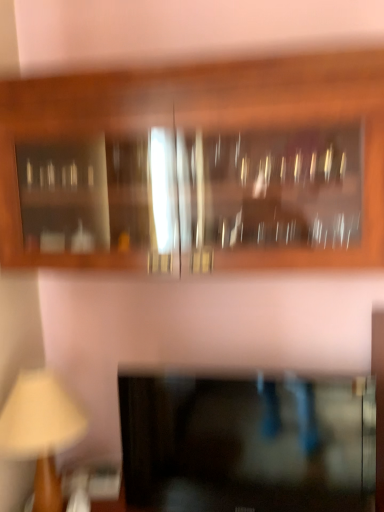
Question: Considering the positions of wooden cabinet at upper center, marked as the 1th cabinetry in a top-to-bottom arrangement, and wooden beige table lamp at lower left in the image, is wooden cabinet at upper center, marked as the 1th cabinetry in a top-to-bottom arrangement, bigger or smaller than wooden beige table lamp at lower left?

Choices:
 (A) small
 (B) big

Answer: (B)

Question: From a real-world perspective, is wooden cabinet at upper center, marked as the 1th cabinetry in a top-to-bottom arrangement, positioned above or below wooden beige table lamp at lower left?

Choices:
 (A) below
 (B) above

Answer: (B)

Question: Estimate the real-world distances between objects in this image. Which object is closer to the wooden cabinet at upper center, marked as the 1th cabinetry in a top-to-bottom arrangement?

Choices:
 (A) wooden beige table lamp at lower left
 (B) black glass cabinet at lower center, the first cabinetry ordered from the bottom

Answer: (B)

Question: Considering the real-world distances, which object is closest to the wooden beige table lamp at lower left?

Choices:
 (A) black glass cabinet at lower center, the first cabinetry ordered from the bottom
 (B) wooden cabinet at upper center, the second cabinetry from the bottom

Answer: (A)